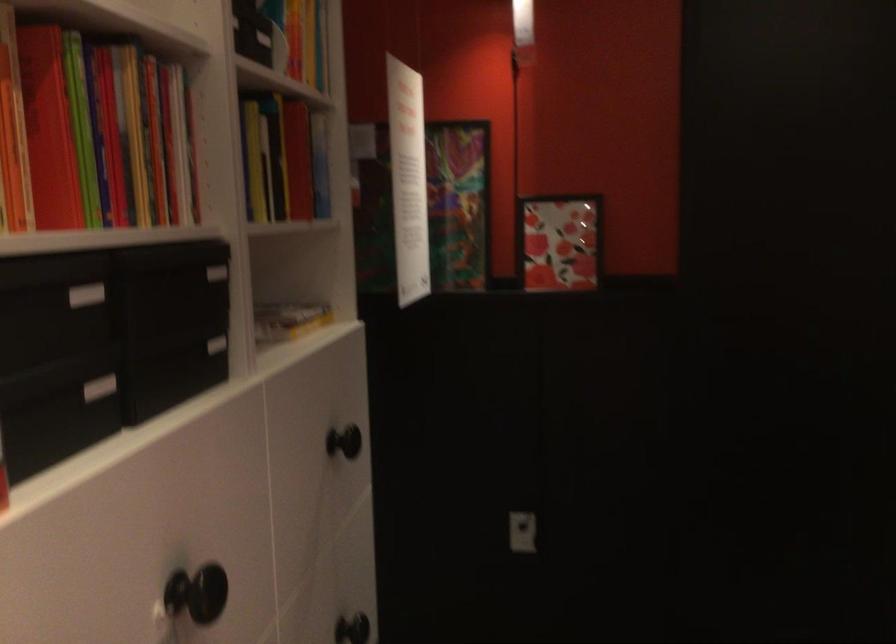
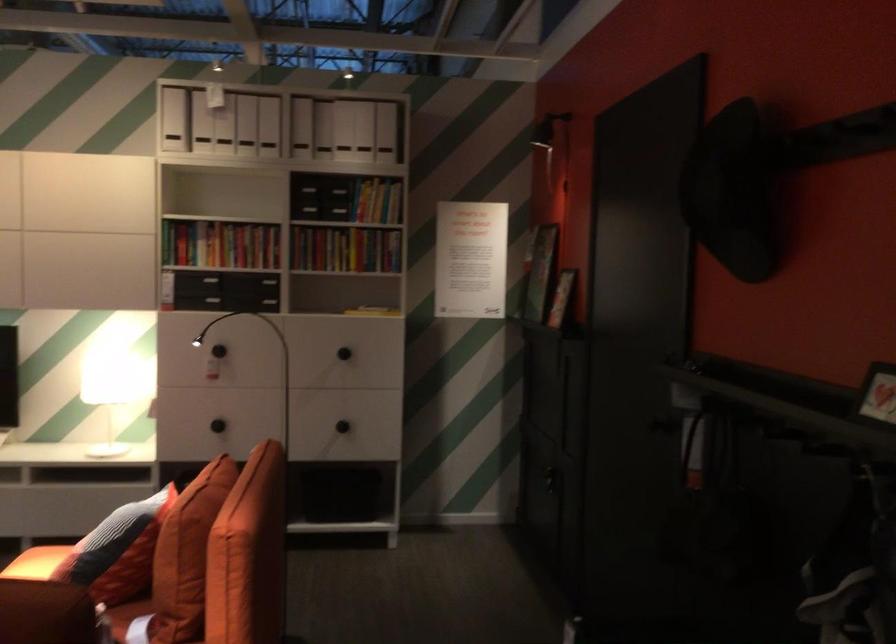
The point at (159,173) is marked in the first image. Where is the corresponding point in the second image?

(220, 243)